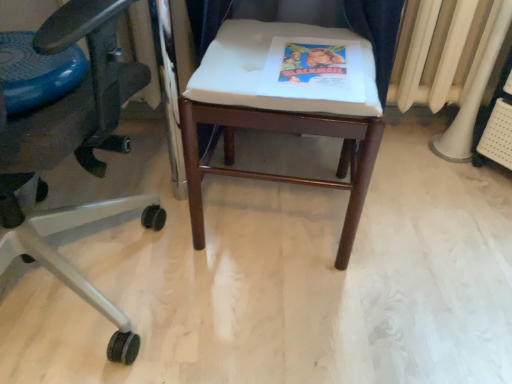
At what (x,y) coordinates should I click in order to perform the action: click on vacant space underneath matte black office chair at left (from a real-world perspective). Please return your answer as a coordinate pair (x, y). Looking at the image, I should click on (60, 324).